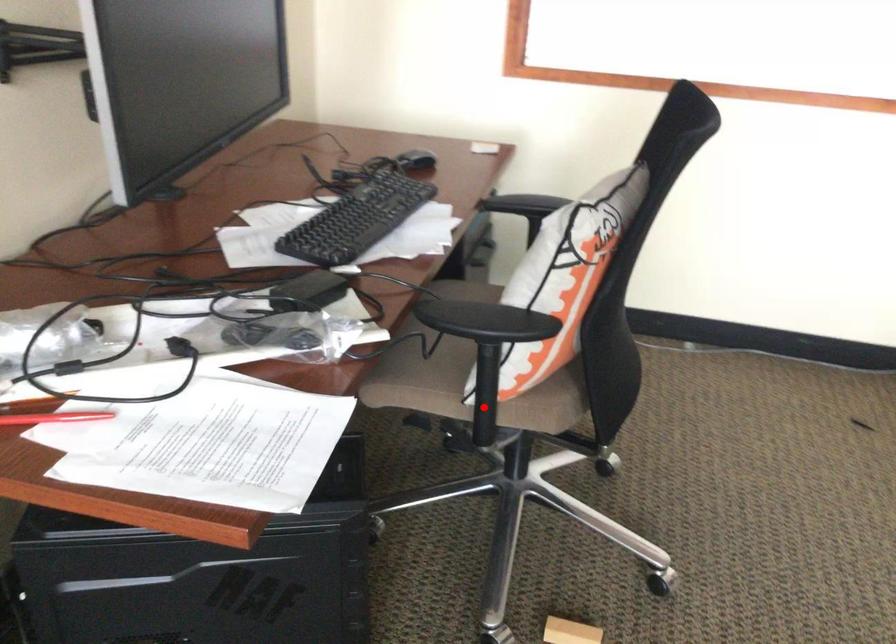
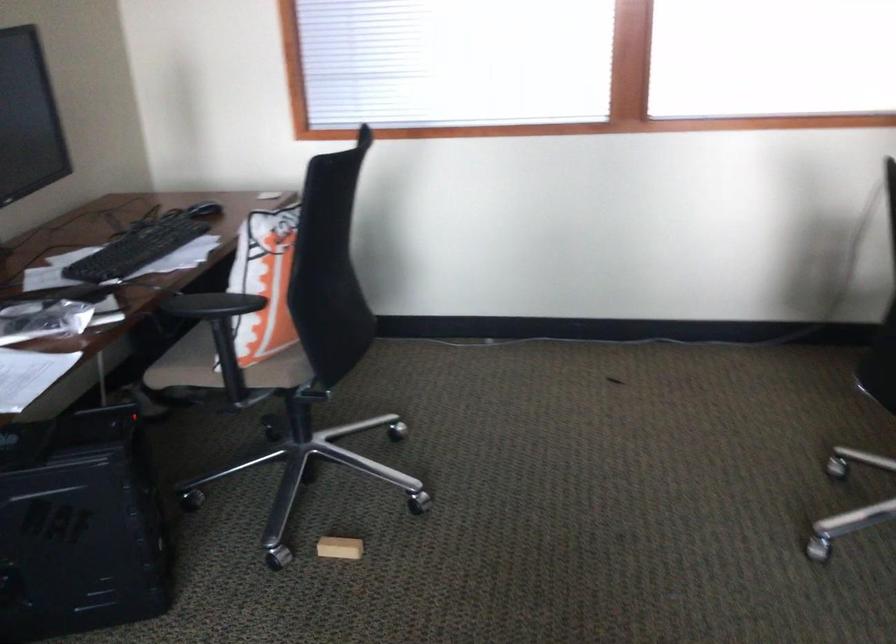
In the second image, find the point that corresponds to the highlighted location in the first image.

(228, 370)